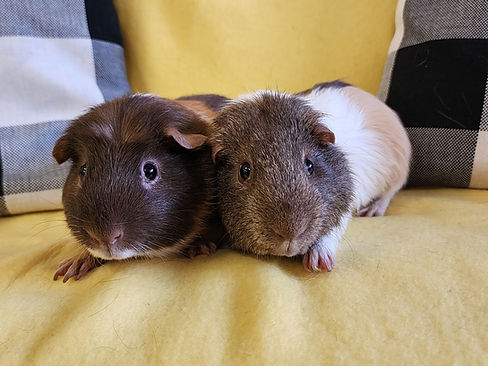
This screenshot has height=366, width=488. What are the coordinates of `dark blue squares on throw pillows` in the screenshot? It's located at (12, 152), (44, 19), (458, 155), (458, 22).